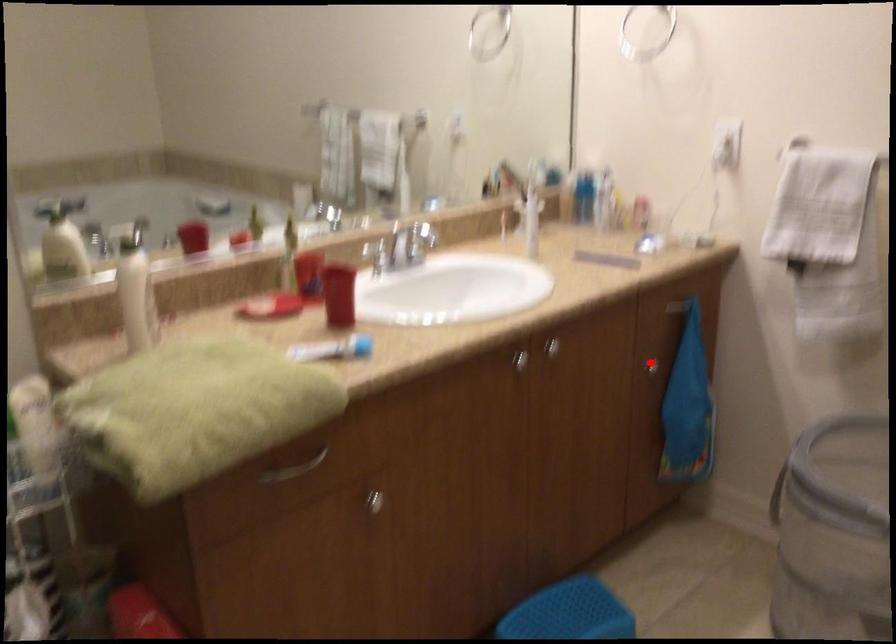
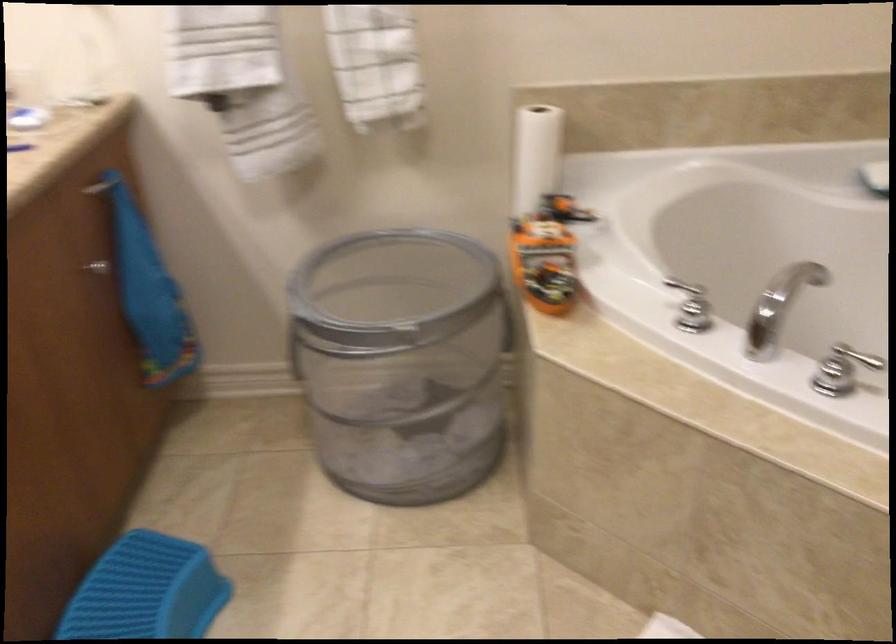
Question: I am providing you with two images of the same scene from different viewpoints. Given a red point in image1, look at the same physical point in image2. Is it:

Choices:
 (A) Closer to the viewpoint
 (B) Farther from the viewpoint

Answer: (A)